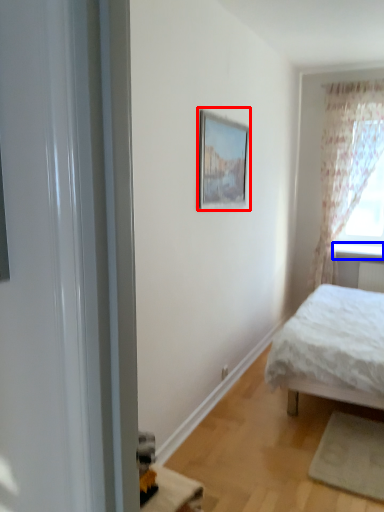
Question: Which object appears closest to the camera in this image, picture frame (highlighted by a red box) or window sill (highlighted by a blue box)?

Choices:
 (A) picture frame
 (B) window sill

Answer: (A)